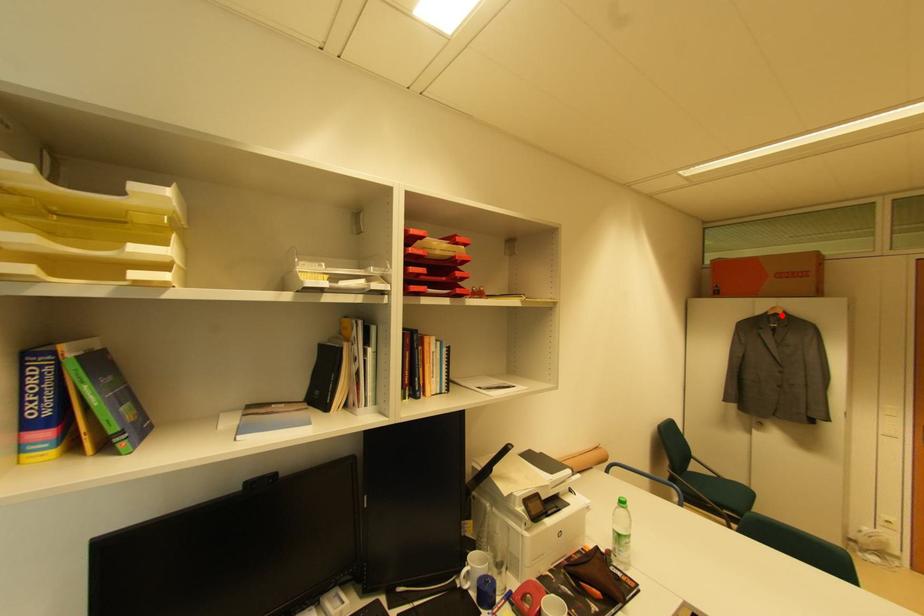
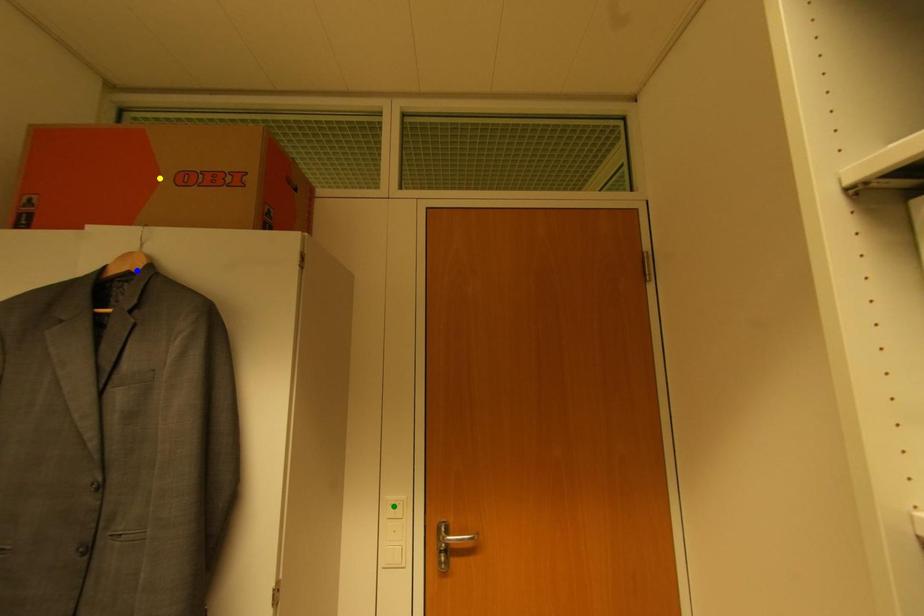
Question: I am providing you with two images of the same scene from different viewpoints. A red point is marked on the first image. You are given multiple points on the second image. Which mark in image 2 goes with the point in image 1?

Choices:
 (A) green point
 (B) yellow point
 (C) blue point

Answer: (C)